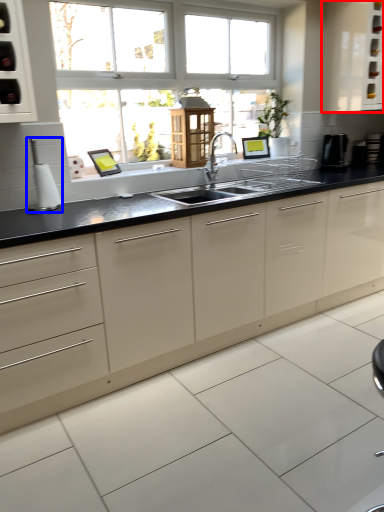
Question: Which object appears closest to the camera in this image, cabinetry (highlighted by a red box) or appliance (highlighted by a blue box)?

Choices:
 (A) cabinetry
 (B) appliance

Answer: (B)